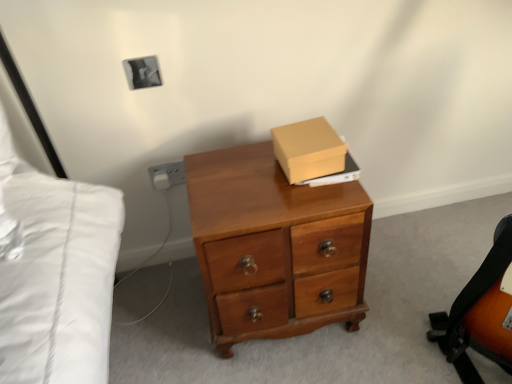
Question: Can you confirm if matte gray electric outlet at lower left is bigger than matte cardboard box at upper center?

Choices:
 (A) no
 (B) yes

Answer: (A)

Question: Can you confirm if matte gray electric outlet at lower left is taller than matte cardboard box at upper center?

Choices:
 (A) yes
 (B) no

Answer: (B)

Question: Does matte gray electric outlet at lower left come behind matte cardboard box at upper center?

Choices:
 (A) no
 (B) yes

Answer: (B)

Question: Is matte gray electric outlet at lower left to the left of matte cardboard box at upper center from the viewer's perspective?

Choices:
 (A) no
 (B) yes

Answer: (B)

Question: From a real-world perspective, is matte gray electric outlet at lower left on top of matte cardboard box at upper center?

Choices:
 (A) no
 (B) yes

Answer: (A)

Question: Considering the relative sizes of matte gray electric outlet at lower left and matte cardboard box at upper center in the image provided, is matte gray electric outlet at lower left shorter than matte cardboard box at upper center?

Choices:
 (A) yes
 (B) no

Answer: (A)

Question: Are matte cardboard box at upper center and wooden desk at center beside each other?

Choices:
 (A) no
 (B) yes

Answer: (A)

Question: From the image's perspective, is matte cardboard box at upper center beneath wooden desk at center?

Choices:
 (A) yes
 (B) no

Answer: (B)

Question: From the image's perspective, is matte cardboard box at upper center above wooden desk at center?

Choices:
 (A) yes
 (B) no

Answer: (A)

Question: Is matte cardboard box at upper center shorter than wooden desk at center?

Choices:
 (A) no
 (B) yes

Answer: (B)

Question: From a real-world perspective, is matte cardboard box at upper center on top of wooden desk at center?

Choices:
 (A) no
 (B) yes

Answer: (B)

Question: Is the depth of matte cardboard box at upper center less than that of wooden desk at center?

Choices:
 (A) yes
 (B) no

Answer: (B)

Question: Is matte gray electric outlet at lower left beside orange leather messenger bag at lower right?

Choices:
 (A) no
 (B) yes

Answer: (A)